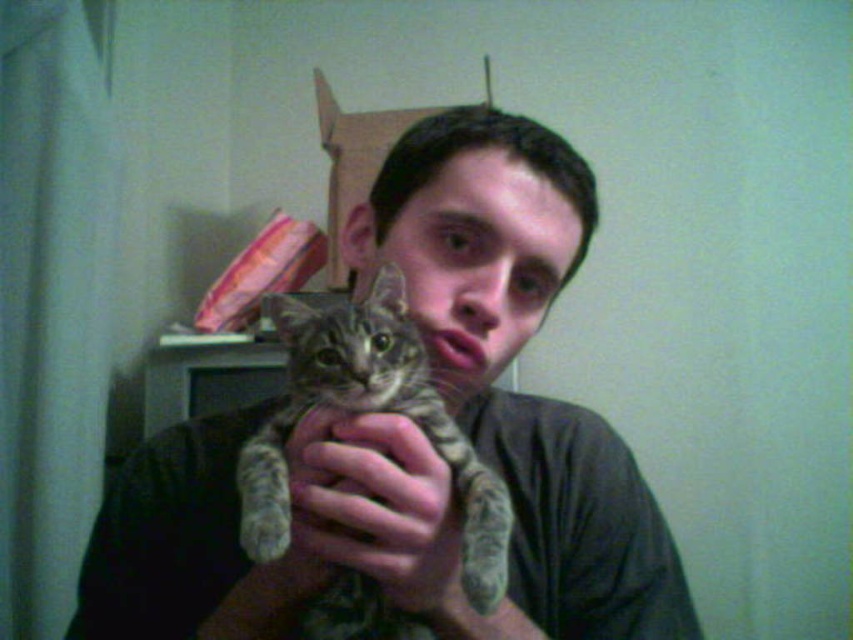
Question: Is tabby fur cat at center above soft fur paw at center?

Choices:
 (A) yes
 (B) no

Answer: (A)

Question: Which is nearer to the smooth gray shirt at center?

Choices:
 (A) soft fur paw at center
 (B) tabby fur cat at center

Answer: (B)

Question: Observing the image, what is the correct spatial positioning of smooth gray shirt at center in reference to soft fur paw at center?

Choices:
 (A) left
 (B) right

Answer: (B)

Question: Where is smooth gray shirt at center located in relation to soft fur paw at center in the image?

Choices:
 (A) above
 (B) below

Answer: (A)

Question: Which is nearer to the tabby fur cat at center?

Choices:
 (A) soft fur paw at center
 (B) smooth gray shirt at center

Answer: (A)

Question: Which point is farther to the camera?

Choices:
 (A) (451, 516)
 (B) (421, 385)

Answer: (B)